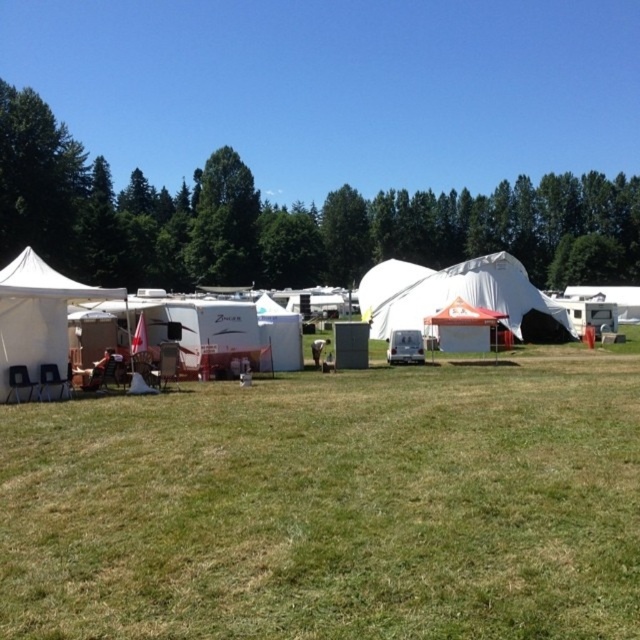
What do you see at coordinates (460, 296) in the screenshot? This screenshot has width=640, height=640. I see `white fabric tent at center` at bounding box center [460, 296].

Who is more distant from viewer, (x=484, y=282) or (x=36, y=333)?

The point (x=484, y=282) is more distant.

At what (x,y) coordinates should I click in order to perform the action: click on white fabric tent at center. Please return your answer as a coordinate pair (x, y). Looking at the image, I should click on click(x=460, y=296).

Which is in front, point (340, 406) or point (419, 289)?

Positioned in front is point (340, 406).

Image resolution: width=640 pixels, height=640 pixels. I want to click on green grassy field at center, so click(332, 506).

Measure the distance between green grassy field at center and camera.

green grassy field at center and camera are 3.76 meters apart.

The width and height of the screenshot is (640, 640). I want to click on green grassy field at center, so click(x=332, y=506).

Based on the photo, can you confirm if white fabric tent at center is thinner than white canvas tent at center?

Yes.

Image resolution: width=640 pixels, height=640 pixels. In order to click on white fabric tent at center in this screenshot , I will do `click(460, 296)`.